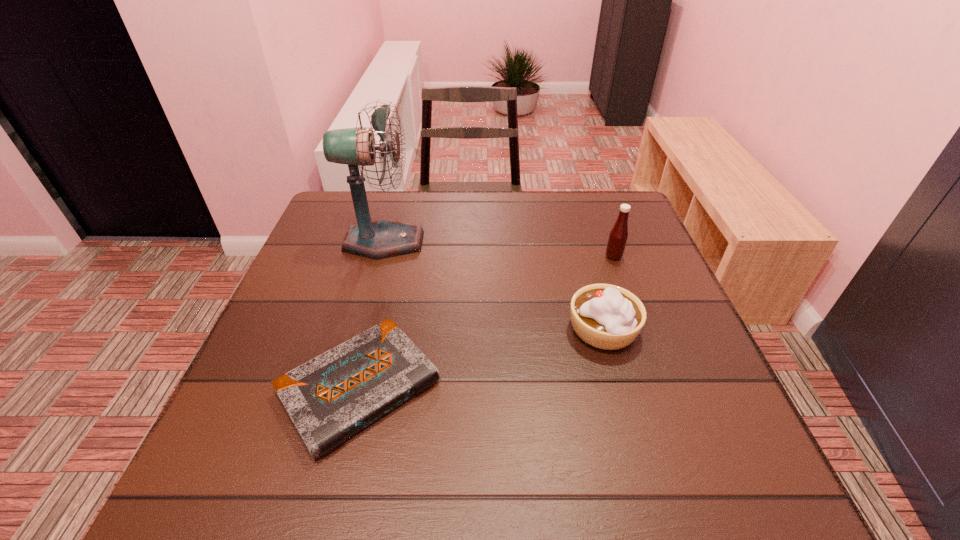
The width and height of the screenshot is (960, 540). In order to click on the tallest object in this screenshot , I will do `click(383, 238)`.

Identify the location of Tabasco sauce. The image size is (960, 540). (618, 235).

Where is `the third tallest object`? Image resolution: width=960 pixels, height=540 pixels. the third tallest object is located at coordinates (605, 316).

Locate an element on the screen. the shortest object is located at coordinates (330, 398).

Locate an element on the screen. Image resolution: width=960 pixels, height=540 pixels. vacant space located 0.200m in front of the tallest object where the wind blows is located at coordinates (497, 241).

Where is `vacant space located 0.110m on the front of the third shortest object`? vacant space located 0.110m on the front of the third shortest object is located at coordinates (626, 291).

The image size is (960, 540). In order to click on free space located on the left of the third tallest object in this screenshot , I will do `click(404, 329)`.

Identify the location of vacant space located 0.070m on the right of the shortest object. (477, 387).

This screenshot has height=540, width=960. What are the coordinates of `object that is at the far edge` in the screenshot? It's located at (383, 238).

The image size is (960, 540). In order to click on object positioned at the near edge in this screenshot , I will do `click(330, 398)`.